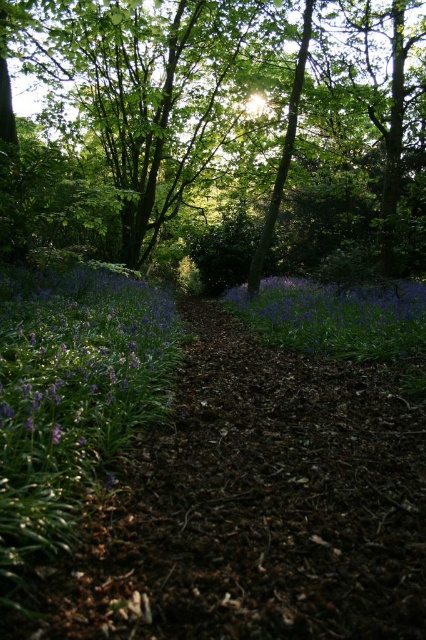
Question: Which object appears farthest from the camera in this image?

Choices:
 (A) purple matte flowers at lower left
 (B) green leafy tree at center

Answer: (B)

Question: Which point is closer to the camera?

Choices:
 (A) (71, 336)
 (B) (310, 54)

Answer: (A)

Question: Is purple matte flowers at lower left to the left of purple matte flower at center from the viewer's perspective?

Choices:
 (A) yes
 (B) no

Answer: (A)

Question: Is green leafy tree at center positioned at the back of purple matte flower at center?

Choices:
 (A) no
 (B) yes

Answer: (A)

Question: Which point appears closest to the camera in this image?

Choices:
 (A) (310, 292)
 (B) (290, 177)
 (C) (140, 371)

Answer: (C)

Question: Can you confirm if green leafy tree at center is wider than purple matte flowers at lower left?

Choices:
 (A) no
 (B) yes

Answer: (B)